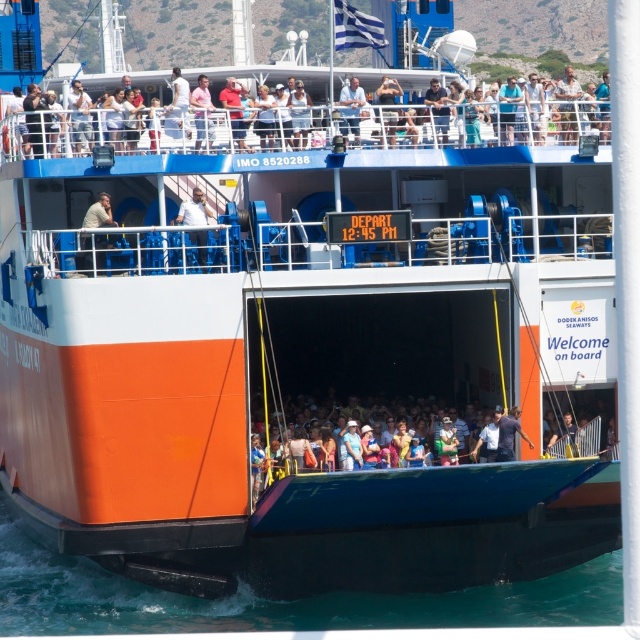
Question: Does matte blue shirt at center have a smaller size compared to light blue denim shirt at upper center?

Choices:
 (A) no
 (B) yes

Answer: (A)

Question: Is matte white shirt at upper center bigger than light blue denim shirt at upper center?

Choices:
 (A) no
 (B) yes

Answer: (B)

Question: Based on their relative distances, which object is farther from the matte white shirt at upper center?

Choices:
 (A) matte blue shirt at center
 (B) light blue denim shirt at upper center
 (C) light brown leather jacket at upper center

Answer: (C)

Question: Can you confirm if matte white shirt at upper center is positioned to the right of matte blue shirt at center?

Choices:
 (A) yes
 (B) no

Answer: (B)

Question: Which of the following is the farthest from the observer?

Choices:
 (A) (202, 83)
 (B) (99, 196)
 (C) (349, 86)

Answer: (C)

Question: Which point appears closest to the camera in this image?

Choices:
 (A) (168, 115)
 (B) (353, 124)
 (C) (106, 212)

Answer: (C)